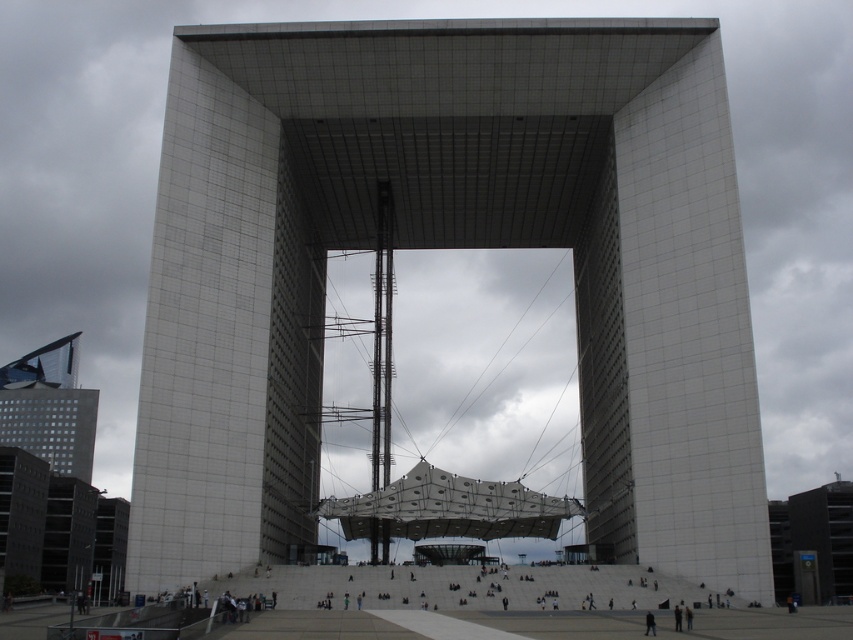
You are standing in the plaza in front of the white textured tower at center. If you face directly towards the tower, which direction should you turn to see the cloudy sky through the archway opening?

Since the white textured tower at center is located at coordinates approximately 0.386 on the x and 0.526 on the y axis, turning to your left would align you with the archway opening that reveals the cloudy sky.

You are standing at the point with coordinates point (448, 246) in the image. What object are you facing?

The point (448, 246) corresponds to the white textured tower at center, so you are facing the white textured tower at center.